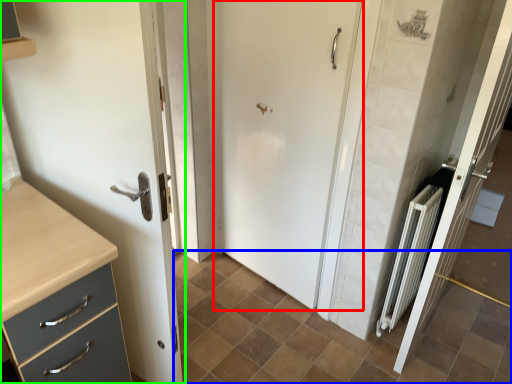
Question: Estimate the real-world distances between objects in this image. Which object is farther from door (highlighted by a red box), ceramic tile (highlighted by a blue box) or door (highlighted by a green box)?

Choices:
 (A) ceramic tile
 (B) door

Answer: (B)